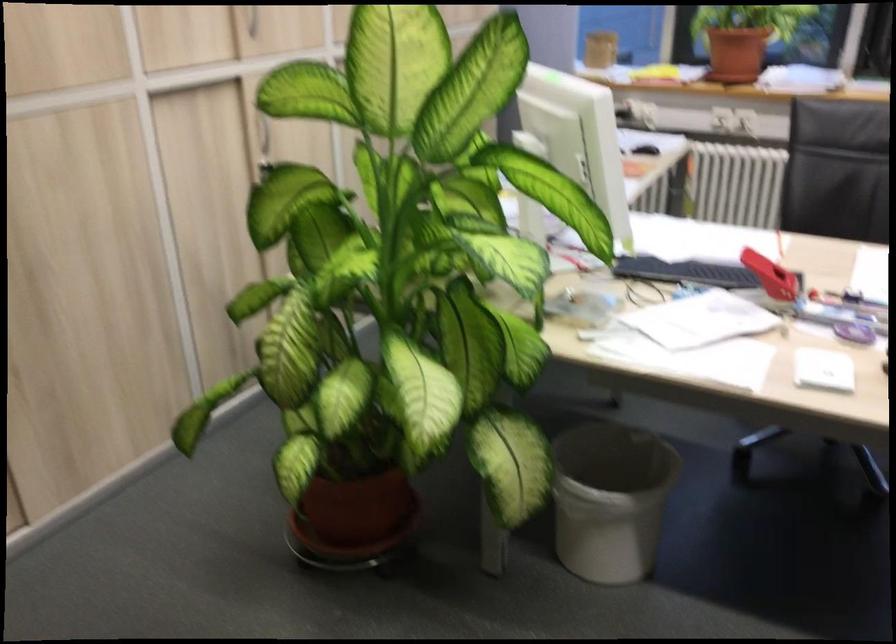
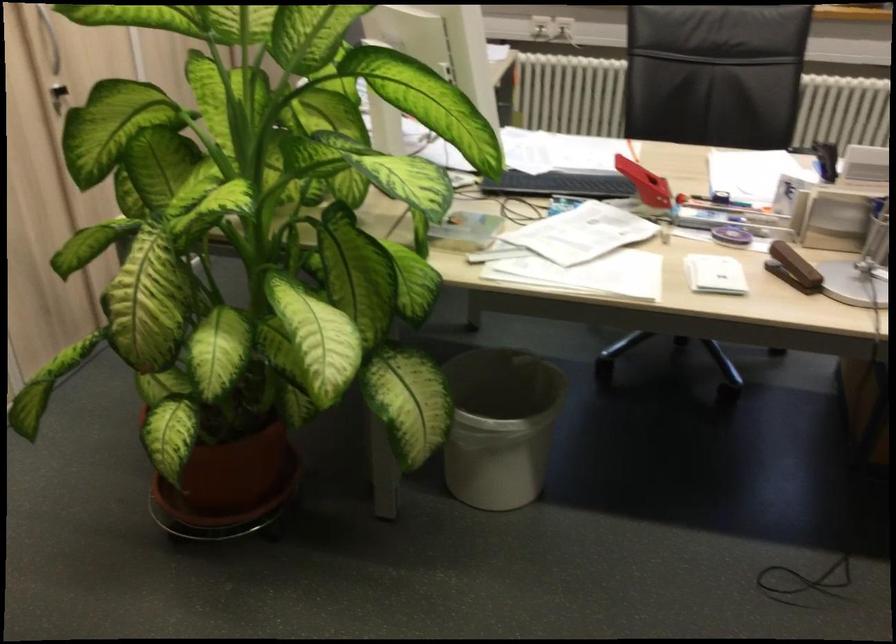
In the second image, find the point that corresponds to [823,371] in the first image.

(714, 274)